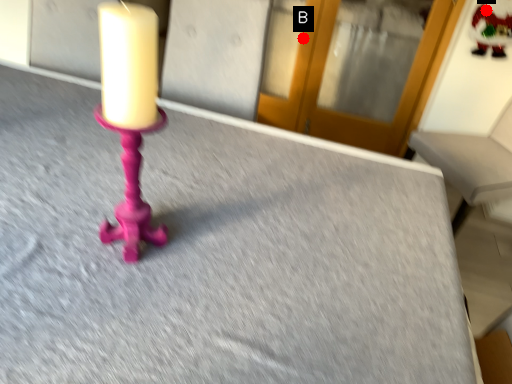
Question: Two points are circled on the image, labeled by A and B beside each circle. Which point appears farthest from the camera in this image?

Choices:
 (A) A is further
 (B) B is further

Answer: (B)